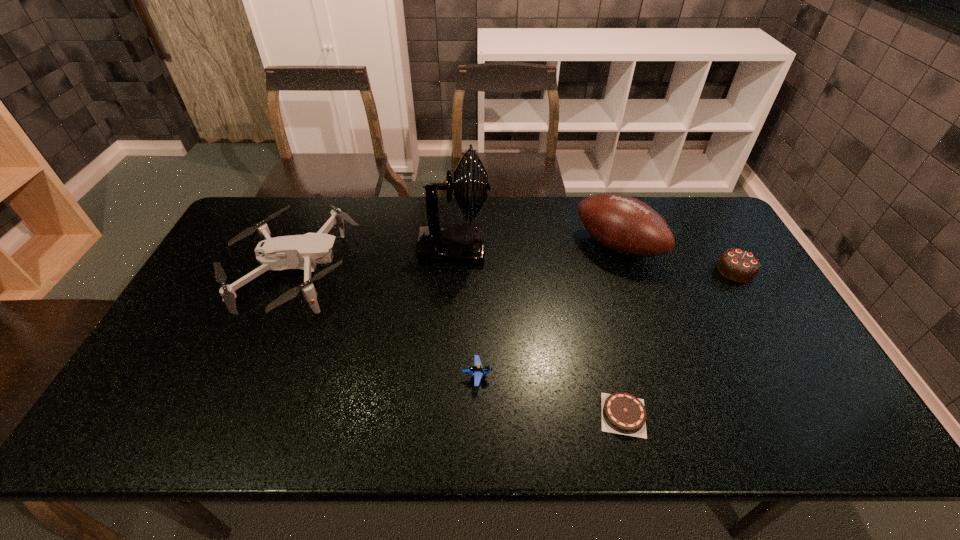
At what (x,y) coordinates should I click in order to perform the action: click on the tallest object. Please return your answer as a coordinate pair (x, y). Looking at the image, I should click on (461, 242).

At what (x,y) coordinates should I click in order to perform the action: click on football (American). Please return your answer as a coordinate pair (x, y). The image size is (960, 540). Looking at the image, I should click on (623, 224).

This screenshot has height=540, width=960. In order to click on the third tallest object in this screenshot , I will do `click(303, 252)`.

At what (x,y) coordinates should I click in order to perform the action: click on the leftmost object. Please return your answer as a coordinate pair (x, y). The height and width of the screenshot is (540, 960). Looking at the image, I should click on (303, 252).

Identify the location of the taller chocolate cake. The image size is (960, 540). (739, 265).

The height and width of the screenshot is (540, 960). In order to click on the rightmost object in this screenshot , I will do `click(739, 265)`.

Locate an element on the screen. The height and width of the screenshot is (540, 960). Lego is located at coordinates (478, 371).

Where is `the second nearest object`? The image size is (960, 540). the second nearest object is located at coordinates (478, 371).

The height and width of the screenshot is (540, 960). What are the coordinates of `the shorter chocolate cake` in the screenshot? It's located at (622, 413).

I want to click on the nearest object, so click(622, 413).